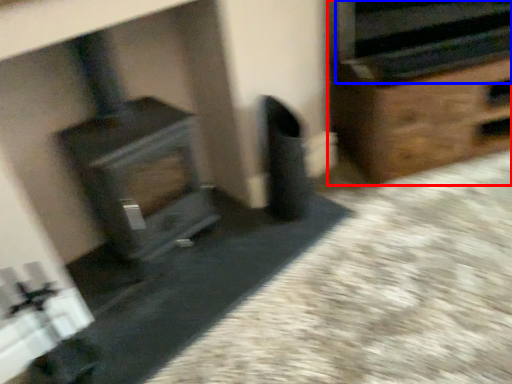
Question: Which object appears farthest to the camera in this image, furniture (highlighted by a red box) or stereo (highlighted by a blue box)?

Choices:
 (A) furniture
 (B) stereo

Answer: (A)